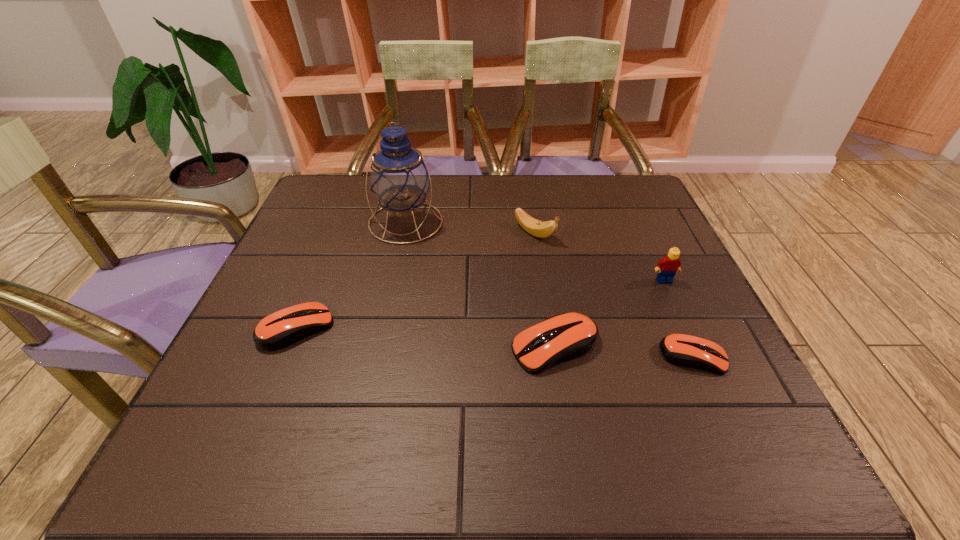
In order to click on free spot between the banana and the second computer mouse from left to right in this screenshot , I will do `click(545, 290)`.

Locate an element on the screen. This screenshot has height=540, width=960. vacant region between the fourth nearest object and the second computer mouse from left to right is located at coordinates (610, 314).

Locate an element on the screen. This screenshot has width=960, height=540. free area in between the leftmost computer mouse and the second computer mouse from left to right is located at coordinates (426, 338).

Where is `free spot between the shortest computer mouse and the second computer mouse from left to right`? The image size is (960, 540). free spot between the shortest computer mouse and the second computer mouse from left to right is located at coordinates coord(624,352).

You are a GUI agent. You are given a task and a screenshot of the screen. Output one action in this format:
    pyautogui.click(x=<x>, y=<y>)
    Task: Click on the unoccupied position between the banana and the third farthest object
    
    Given the screenshot: What is the action you would take?
    [x=599, y=256]

Identify the location of free space between the banana and the rightmost computer mouse. The height and width of the screenshot is (540, 960). (613, 295).

The width and height of the screenshot is (960, 540). Find the location of `object that stands as the third closest to the lantern`. object that stands as the third closest to the lantern is located at coordinates (567, 336).

Point out which object is positioned as the fourth nearest to the third farthest object. Please provide its 2D coordinates. Your answer should be formatted as a tuple, i.e. [(x, y)], where the tuple contains the x and y coordinates of a point satisfying the conditions above.

[(399, 178)]

Choose which computer mouse is the second nearest neighbor to the shortest object. Please provide its 2D coordinates. Your answer should be formatted as a tuple, i.e. [(x, y)], where the tuple contains the x and y coordinates of a point satisfying the conditions above.

[(285, 327)]

You are a GUI agent. You are given a task and a screenshot of the screen. Output one action in this format:
    pyautogui.click(x=<x>, y=<y>)
    Task: Click on the second closest computer mouse to the second computer mouse from left to right
    
    Given the screenshot: What is the action you would take?
    pyautogui.click(x=285, y=327)